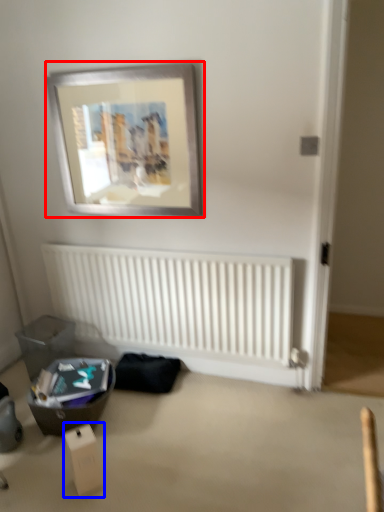
Question: Among these objects, which one is farthest to the camera, picture frame (highlighted by a red box) or cardboard box (highlighted by a blue box)?

Choices:
 (A) picture frame
 (B) cardboard box

Answer: (A)